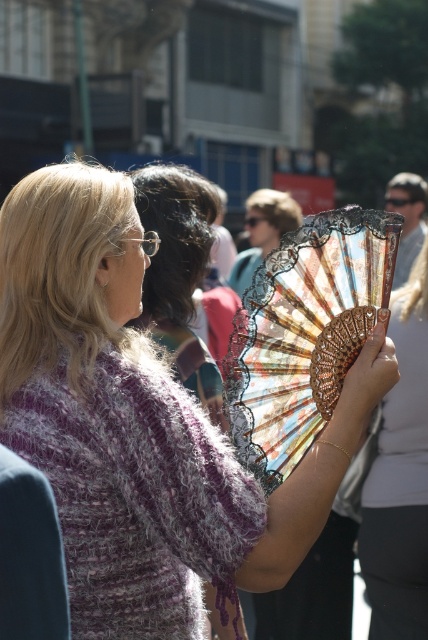
Consider the image. You are standing at the origin of the coordinate system in this scene. There are two points marked in the image, point A at point (100, 349) and point B at point (395, 380). Which point is closer to you?

Point A at point (100, 349) is closer to you because it is in front of point B at point (395, 380).